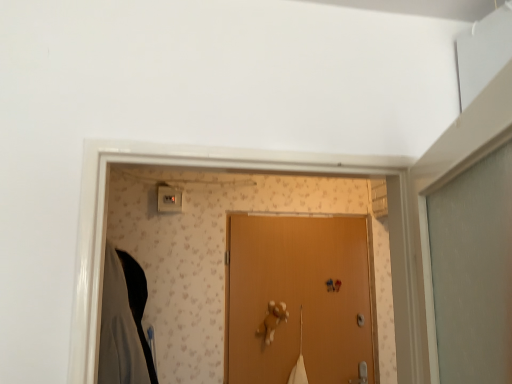
Question: Do you think white plastic light switch at upper center is within black matte robe at left, or outside of it?

Choices:
 (A) inside
 (B) outside

Answer: (B)

Question: In terms of size, does white plastic light switch at upper center appear bigger or smaller than black matte robe at left?

Choices:
 (A) big
 (B) small

Answer: (B)

Question: Estimate the real-world distances between objects in this image. Which object is closer to the black matte robe at left?

Choices:
 (A) white plastic light switch at upper center
 (B) wooden door at center

Answer: (A)

Question: Based on their relative distances, which object is nearer to the white plastic light switch at upper center?

Choices:
 (A) wooden door at center
 (B) black matte robe at left

Answer: (B)